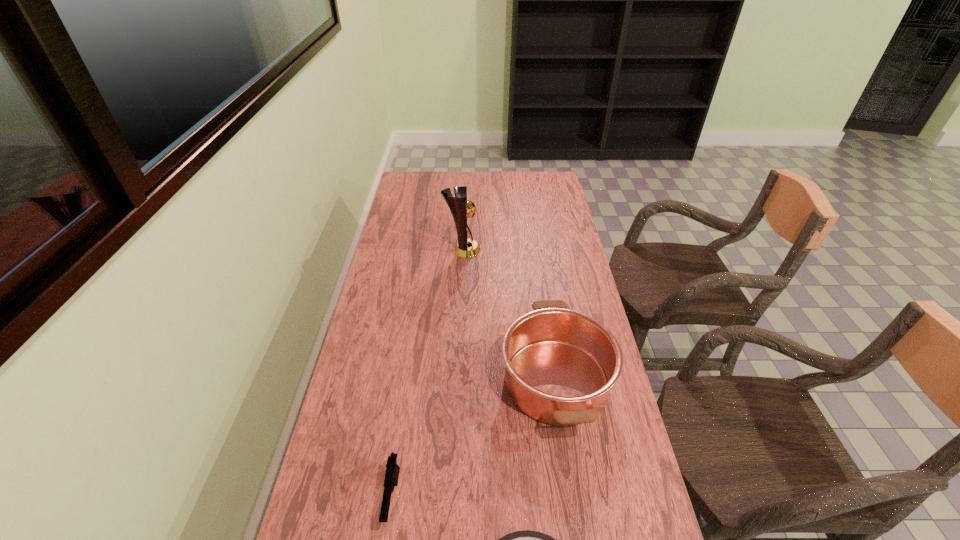
Where is `award`? The image size is (960, 540). award is located at coordinates (466, 248).

Identify the location of the farthest object. The width and height of the screenshot is (960, 540). (466, 248).

Where is `the third nearest object`? the third nearest object is located at coordinates (560, 364).

Locate an element on the screen. the second tallest object is located at coordinates (560, 364).

Identify the location of the leftmost object. This screenshot has width=960, height=540. (392, 469).

Image resolution: width=960 pixels, height=540 pixels. Identify the location of pistol. (392, 469).

In order to click on vacant space positioned 0.110m at the front of the award, where the globe is visible in this screenshot , I will do `click(509, 250)`.

Locate an element on the screen. This screenshot has height=540, width=960. free spot located 0.100m on the front of the third nearest object is located at coordinates (573, 490).

Find the location of a particular element. object situated at the right edge is located at coordinates (560, 364).

In the image, there is a desktop. Identify the location of vacant space at the far edge. (435, 191).